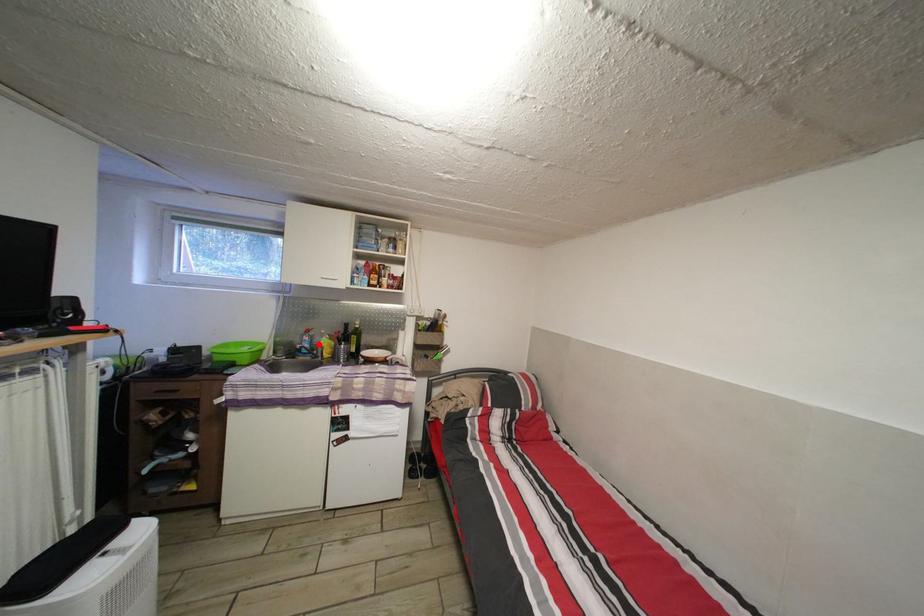
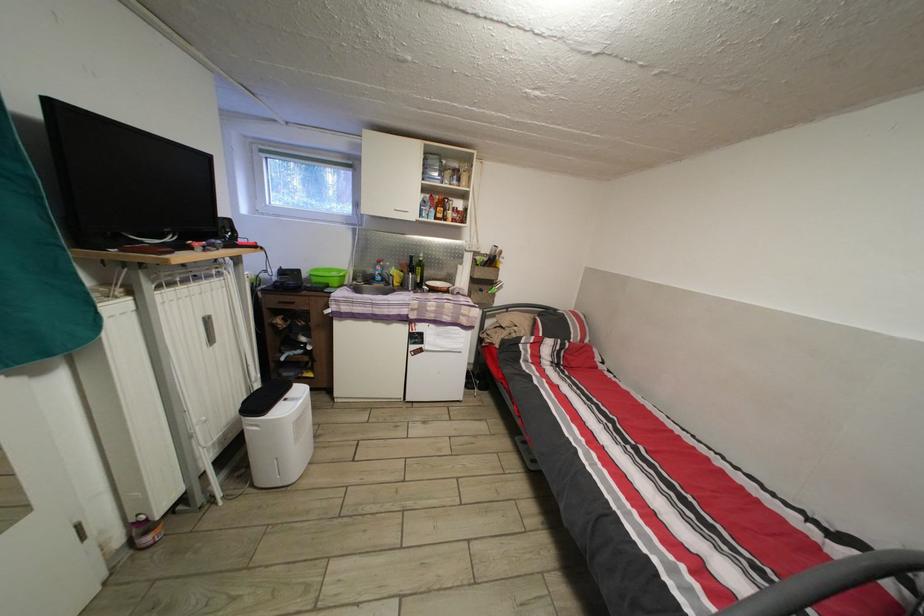
Locate, in the second image, the point that corresponds to the highlighted location in the first image.

(390, 274)